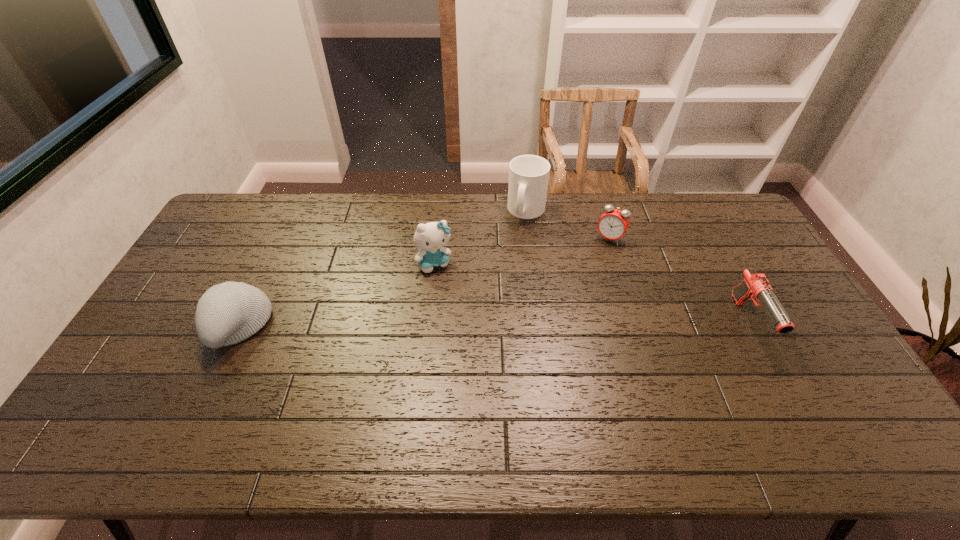
Locate an element on the screen. The image size is (960, 540). alarm clock present at the far edge is located at coordinates (612, 225).

Find the location of a particular element. This screenshot has width=960, height=540. object located at the right edge is located at coordinates (755, 285).

In the image, there is a desktop. Identify the location of vacant space at the far edge. (654, 215).

Image resolution: width=960 pixels, height=540 pixels. In the image, there is a desktop. Identify the location of blank space at the near edge. (312, 400).

You are a GUI agent. You are given a task and a screenshot of the screen. Output one action in this format:
    pyautogui.click(x=<x>, y=<y>)
    Task: Click on the vacant space at the left edge of the desktop
    
    Given the screenshot: What is the action you would take?
    pyautogui.click(x=194, y=327)

In order to click on free space at the right edge of the desktop in this screenshot , I will do `click(737, 252)`.

Image resolution: width=960 pixels, height=540 pixels. I want to click on empty location between the mug and the beanie, so click(x=382, y=269).

You are a GUI agent. You are given a task and a screenshot of the screen. Output one action in this format:
    pyautogui.click(x=<x>, y=<y>)
    Task: Click on the free space between the rightmost object and the farthest object
    
    Given the screenshot: What is the action you would take?
    pyautogui.click(x=637, y=267)

Where is `unoccupied position between the kitten and the rightmost object`? unoccupied position between the kitten and the rightmost object is located at coordinates (592, 292).

The width and height of the screenshot is (960, 540). In order to click on unoccupied area between the rightmost object and the farthest object in this screenshot , I will do `click(637, 267)`.